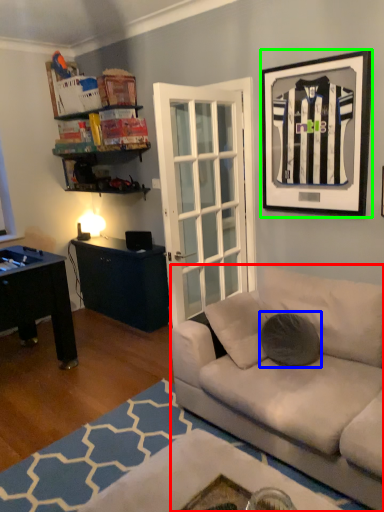
Question: Which object is the farthest from studio couch (highlighted by a red box)? Choose among these: pillow (highlighted by a blue box) or picture frame (highlighted by a green box).

Choices:
 (A) pillow
 (B) picture frame

Answer: (B)